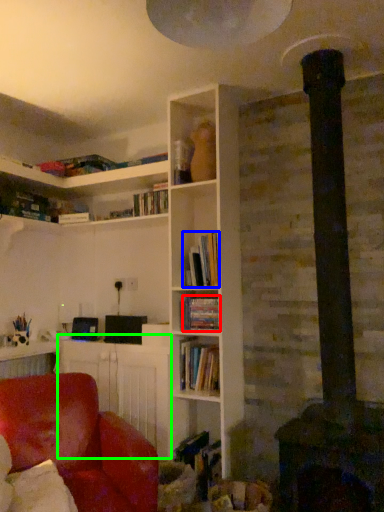
Question: Based on their relative distances, which object is farther from book (highlighted by a red box)? Choose from book (highlighted by a blue box) and table (highlighted by a green box).

Choices:
 (A) book
 (B) table

Answer: (B)